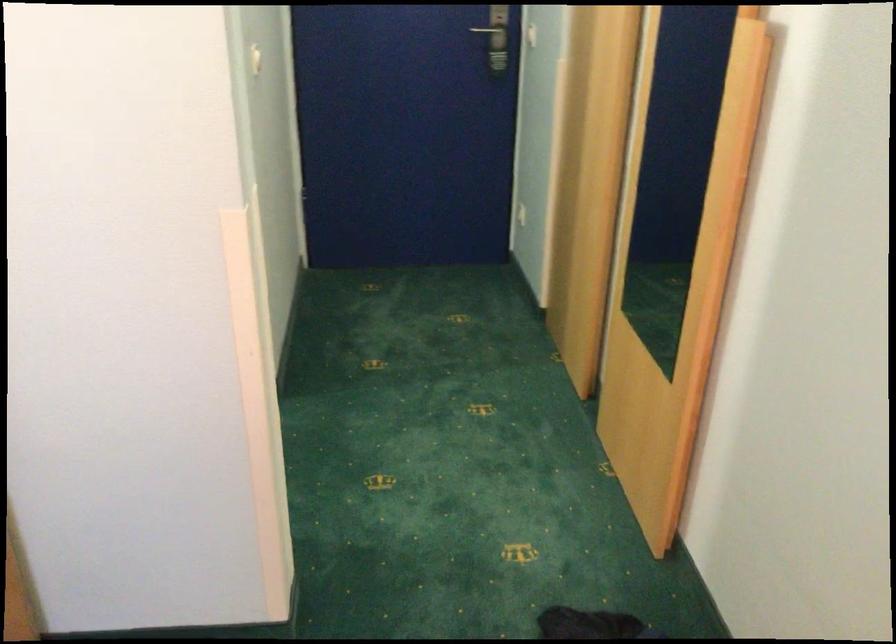
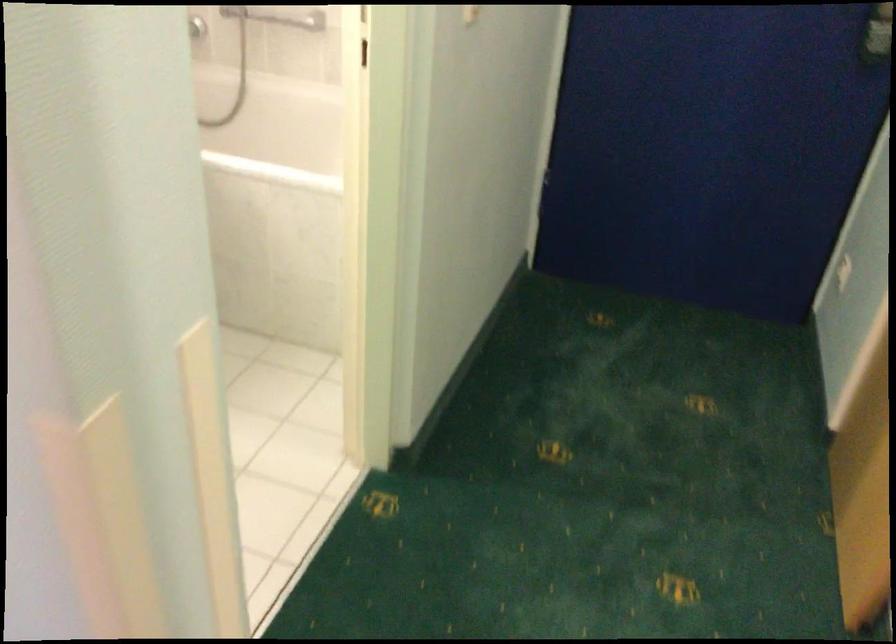
Question: What movement of the cameraman would produce the second image?

Choices:
 (A) Left
 (B) Right
 (C) Forward
 (D) Backward

Answer: (C)